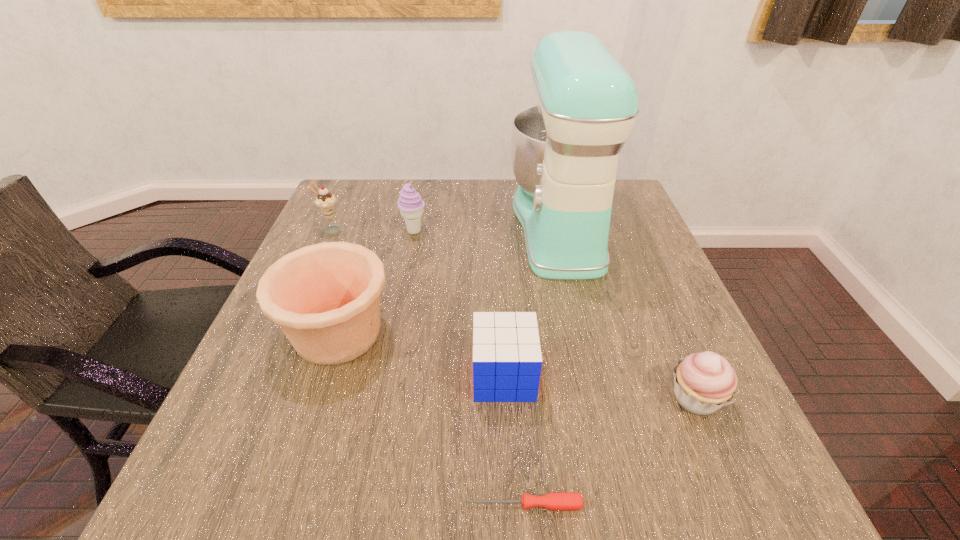
What are the coordinates of `object that is at the near edge` in the screenshot? It's located at (558, 501).

At what (x,y) coordinates should I click in order to perform the action: click on icecream that is at the left edge. Please return your answer as a coordinate pair (x, y). Looking at the image, I should click on (326, 202).

This screenshot has height=540, width=960. In order to click on pottery present at the left edge in this screenshot , I will do `click(325, 297)`.

In order to click on mixer at the right edge in this screenshot , I will do `click(564, 152)`.

What are the coordinates of `cupcake positioned at the right edge` in the screenshot? It's located at (703, 382).

This screenshot has width=960, height=540. In order to click on object that is at the far right corner in this screenshot , I will do `click(564, 152)`.

The image size is (960, 540). In the image, there is a desktop. In order to click on vacant space at the far edge in this screenshot , I will do `click(419, 188)`.

Locate an element on the screen. Image resolution: width=960 pixels, height=540 pixels. vacant area at the near edge of the desktop is located at coordinates (573, 512).

This screenshot has width=960, height=540. In the image, there is a desktop. In order to click on free space at the left edge in this screenshot , I will do `click(244, 434)`.

You are a GUI agent. You are given a task and a screenshot of the screen. Output one action in this format:
    pyautogui.click(x=<x>, y=<y>)
    Task: Click on the vacant space at the right edge of the desktop
    
    Given the screenshot: What is the action you would take?
    pyautogui.click(x=687, y=415)